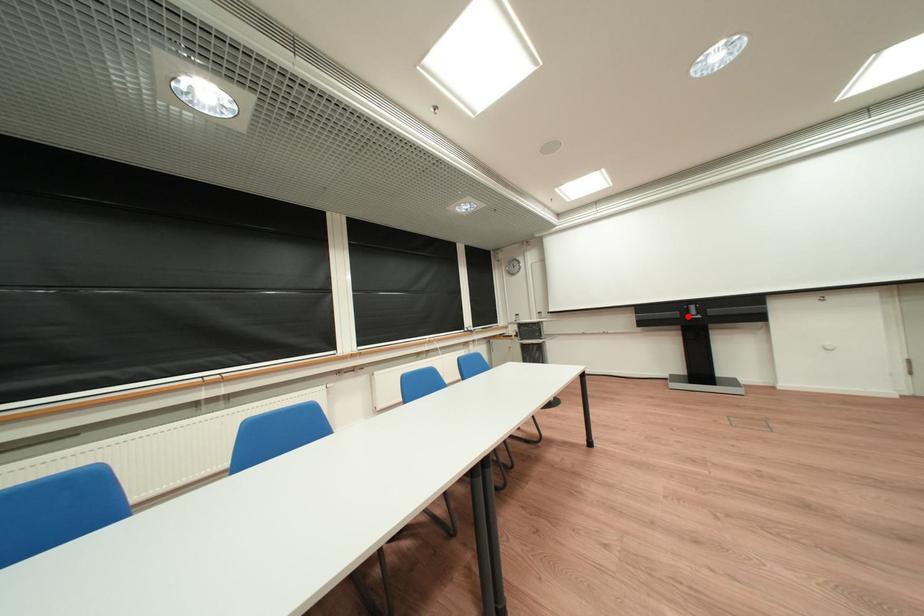
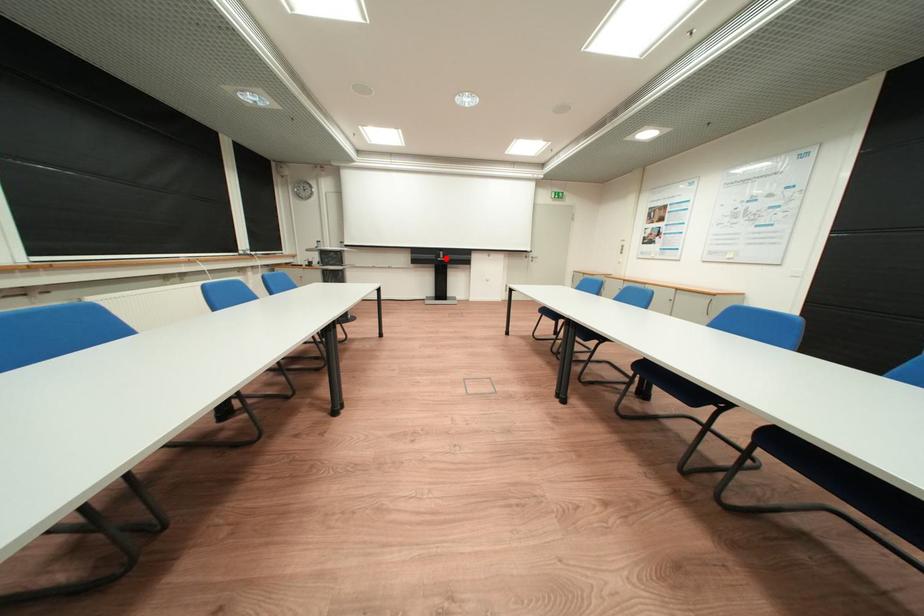
I am providing you with two images of the same scene from different viewpoints. A red point is marked on the first image and another point is marked on the second image. Does the point marked in image1 correspond to the same location as the one in image2?

Yes